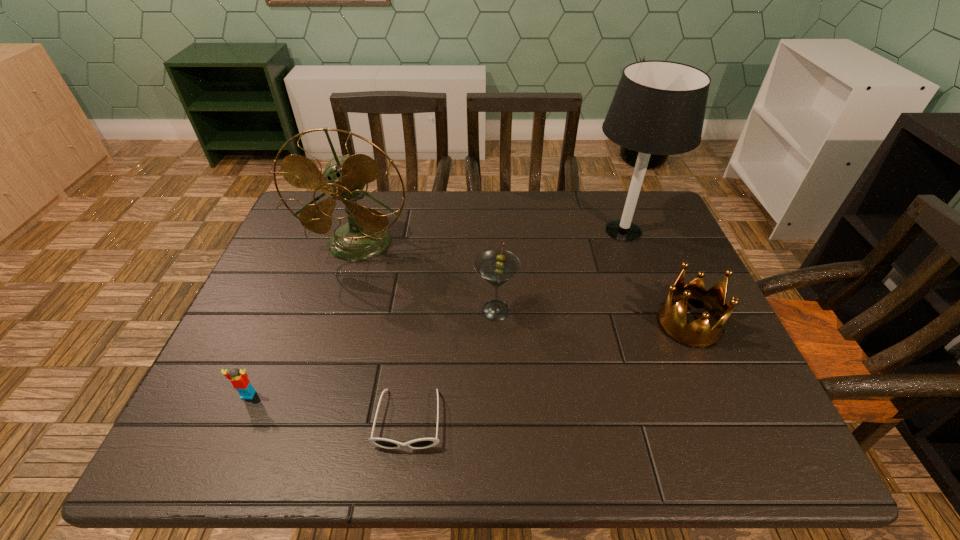
Identify the location of vacant space that's between the third object from right to left and the shortest object. (452, 365).

This screenshot has width=960, height=540. Find the location of `free spot between the martini and the shortest object`. free spot between the martini and the shortest object is located at coordinates (452, 365).

The image size is (960, 540). Find the location of `empty location between the third shortest object and the third object from right to left`. empty location between the third shortest object and the third object from right to left is located at coordinates (592, 317).

Locate an element on the screen. Image resolution: width=960 pixels, height=540 pixels. free point between the crown and the Lego is located at coordinates point(468,359).

Image resolution: width=960 pixels, height=540 pixels. Find the location of `free space between the martini and the tallest object`. free space between the martini and the tallest object is located at coordinates (560, 271).

This screenshot has height=540, width=960. Find the location of `free space between the fifth tallest object and the shortest object`. free space between the fifth tallest object and the shortest object is located at coordinates tap(328, 407).

The height and width of the screenshot is (540, 960). Find the location of `free area in between the fifth tallest object and the sunglasses`. free area in between the fifth tallest object and the sunglasses is located at coordinates (328, 407).

Locate which object is the fourth closest to the crown. Please provide its 2D coordinates. Your answer should be formatted as a tuple, i.e. [(x, y)], where the tuple contains the x and y coordinates of a point satisfying the conditions above.

[(366, 235)]

I want to click on object that is the fifth nearest to the fifth tallest object, so click(698, 334).

Where is `vacant area that satisfies the following two spatial constraints: 1. in front of the second tallest object, directing air flow; 2. on the right side of the third tallest object`? The height and width of the screenshot is (540, 960). vacant area that satisfies the following two spatial constraints: 1. in front of the second tallest object, directing air flow; 2. on the right side of the third tallest object is located at coordinates (339, 310).